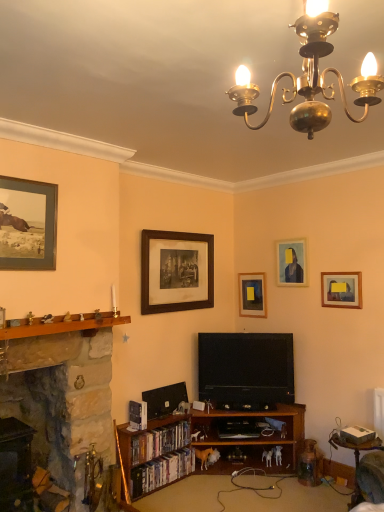
Question: Should I look upward or downward to see wooden framed print at center, which is the 4th picture frame in right-to-left order?

Choices:
 (A) down
 (B) up

Answer: (A)

Question: Is wooden picture frame at center, placed as the third picture frame when sorted from left to right, to the left of matte wooden picture frame at upper left, the 5th picture frame viewed from the back, from the viewer's perspective?

Choices:
 (A) yes
 (B) no

Answer: (B)

Question: Is wooden picture frame at center, the 1th picture frame when ordered from back to front, thinner than matte wooden picture frame at upper left, the 5th picture frame viewed from the back?

Choices:
 (A) no
 (B) yes

Answer: (B)

Question: Is wooden picture frame at center, which appears as the 3th picture frame when viewed from the right, oriented away from matte wooden picture frame at upper left, the 5th picture frame from the right?

Choices:
 (A) no
 (B) yes

Answer: (A)

Question: From a real-world perspective, is wooden picture frame at center, placed as the third picture frame when sorted from left to right, below matte wooden picture frame at upper left, the 5th picture frame viewed from the back?

Choices:
 (A) yes
 (B) no

Answer: (A)

Question: Is there a large distance between wooden picture frame at center, which appears as the 3th picture frame when viewed from the right, and matte wooden picture frame at upper left, the 5th picture frame viewed from the back?

Choices:
 (A) yes
 (B) no

Answer: (A)

Question: Does wooden picture frame at center, which is counted as the fifth picture frame, starting from the front, have a smaller size compared to matte wooden picture frame at upper left, the 5th picture frame from the right?

Choices:
 (A) no
 (B) yes

Answer: (B)

Question: Does black glossy bookshelf at lower left, placed as the 2th book when sorted from top to bottom, have a greater width compared to matte wooden picture frame at upper right, arranged as the 2th picture frame when viewed from the back?

Choices:
 (A) yes
 (B) no

Answer: (A)

Question: Is black glossy bookshelf at lower left, placed as the 2th book when sorted from top to bottom, in contact with matte wooden picture frame at upper right, which is counted as the fourth picture frame, starting from the front?

Choices:
 (A) yes
 (B) no

Answer: (B)

Question: From a real-world perspective, is black glossy bookshelf at lower left, placed as the 2th book when sorted from top to bottom, over matte wooden picture frame at upper right, which is counted as the 2th picture frame, starting from the right?

Choices:
 (A) no
 (B) yes

Answer: (A)

Question: Is matte wooden picture frame at upper right, arranged as the 2th picture frame when viewed from the back, surrounded by black glossy bookshelf at lower left, the first book when ordered from bottom to top?

Choices:
 (A) no
 (B) yes

Answer: (A)

Question: Is black glossy bookshelf at lower left, the first book when ordered from bottom to top, not inside matte wooden picture frame at upper right, arranged as the 2th picture frame when viewed from the back?

Choices:
 (A) yes
 (B) no

Answer: (A)

Question: From the image's perspective, does black glossy bookshelf at lower left, the first book when ordered from bottom to top, appear lower than matte wooden picture frame at upper right, which is counted as the fourth picture frame, starting from the front?

Choices:
 (A) no
 (B) yes

Answer: (B)

Question: Is wooden at left wider than matte wooden picture frame at upper right, arranged as the 2th picture frame when viewed from the back?

Choices:
 (A) yes
 (B) no

Answer: (A)